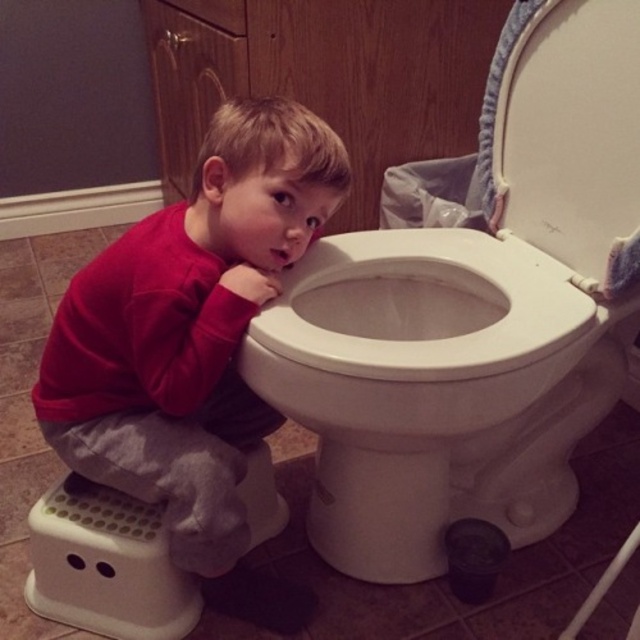
Does white glossy toilet bowl at center have a greater height compared to red fleece shirt at center?

Incorrect, white glossy toilet bowl at center's height is not larger of red fleece shirt at center's.

Does white glossy toilet bowl at center appear under red fleece shirt at center?

Yes, white glossy toilet bowl at center is below red fleece shirt at center.

Where is `white glossy toilet bowl at center`? This screenshot has height=640, width=640. white glossy toilet bowl at center is located at coordinates (433, 390).

Measure the distance between white glossy toilet bowl at center and camera.

69.62 centimeters

From the picture: Which of these two, white glossy toilet bowl at center or white plastic step stool at lower left, stands taller?

Standing taller between the two is white glossy toilet bowl at center.

Is point (416, 380) positioned in front of point (257, 540)?

Yes, it is.

You are a GUI agent. You are given a task and a screenshot of the screen. Output one action in this format:
    pyautogui.click(x=<x>, y=<y>)
    Task: Click on the white glossy toilet bowl at center
    This screenshot has width=640, height=640.
    Given the screenshot: What is the action you would take?
    pyautogui.click(x=433, y=390)

Between point (253, 291) and point (32, 532), which one is positioned behind?

Positioned behind is point (32, 532).

Which is more to the right, red fleece shirt at center or white plastic step stool at lower left?

Positioned to the right is red fleece shirt at center.

Is point (42, 369) farther from camera compared to point (68, 474)?

No, it is not.

This screenshot has width=640, height=640. Identify the location of red fleece shirt at center. (193, 344).